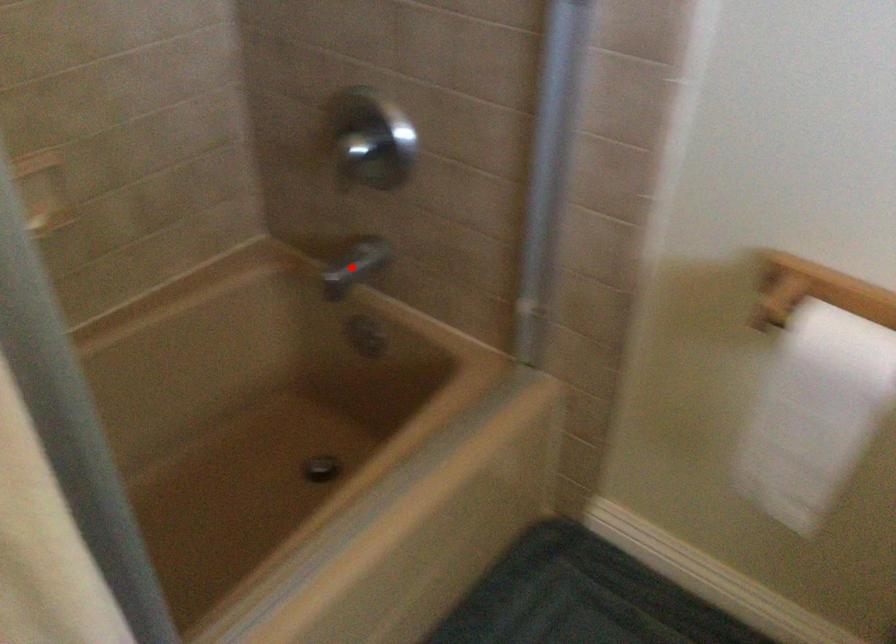
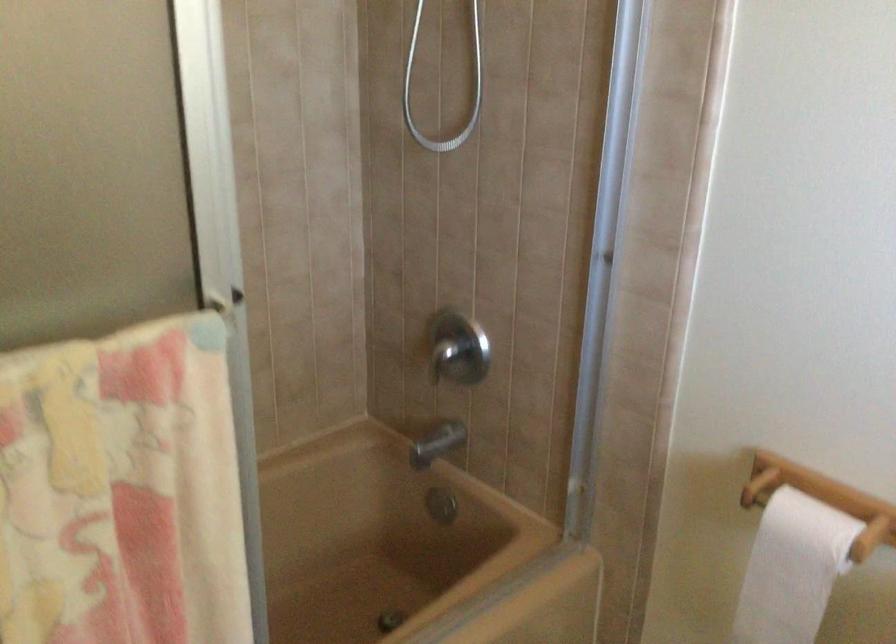
Question: I am providing you with two images of the same scene from different viewpoints. In image1, a red point is highlighted. Considering the same 3D point in image2, which of the following is correct?

Choices:
 (A) It is closer
 (B) It is farther

Answer: (B)